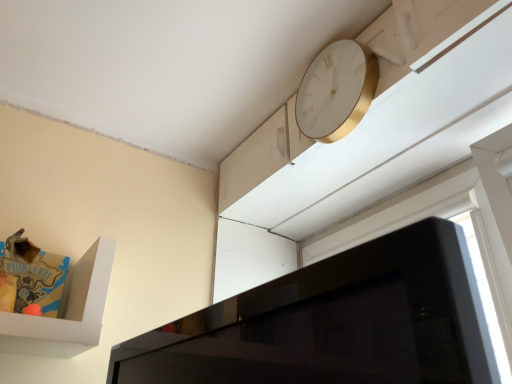
Question: In terms of size, does white gold clock at upper right appear bigger or smaller than white glossy window at upper right?

Choices:
 (A) big
 (B) small

Answer: (B)

Question: Relative to white glossy window at upper right, is white gold clock at upper right in front or behind?

Choices:
 (A) front
 (B) behind

Answer: (B)

Question: In terms of width, does white gold clock at upper right look wider or thinner when compared to white glossy window at upper right?

Choices:
 (A) thin
 (B) wide

Answer: (A)

Question: Is point (438, 193) closer or farther from the camera than point (349, 107)?

Choices:
 (A) closer
 (B) farther

Answer: (B)

Question: From their relative heights in the image, would you say white glossy window at upper right is taller or shorter than white gold clock at upper right?

Choices:
 (A) short
 (B) tall

Answer: (B)

Question: In terms of size, does white glossy window at upper right appear bigger or smaller than white gold clock at upper right?

Choices:
 (A) big
 (B) small

Answer: (A)

Question: Is white glossy window at upper right situated inside white gold clock at upper right or outside?

Choices:
 (A) outside
 (B) inside

Answer: (A)